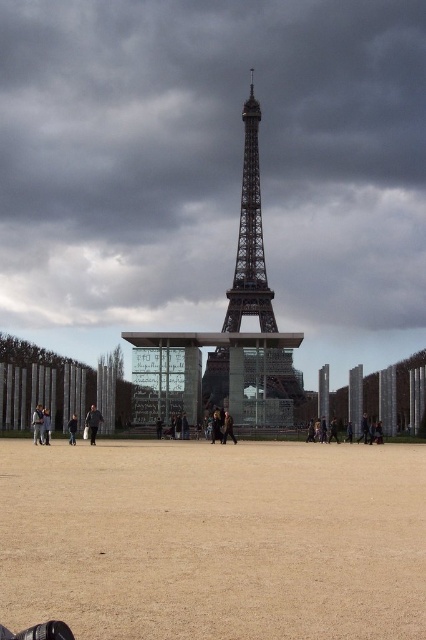
You are standing in the plaza in front of the Eiffel Tower and notice both the dark gray cloudy sky at upper center and the dark brown leather jacket at center. Which object is closer to you?

The dark brown leather jacket at center is behind the dark gray cloudy sky at upper center, so the dark gray cloudy sky at upper center is closer to you.

In the scene shown: You are an architect planning to install a large sculpture in the plaza area. Given the dark gray cloudy sky at upper center and the brown sandy dirt field at center, which one has a greater width in the image?

The dark gray cloudy sky at upper center might be wider than the brown sandy dirt field at center according to the description.

You are a tourist standing in front of the Eiffel Tower and looking at the dark gray cloudy sky at upper center and the brown sandy dirt field at center. Which object is closer to you?

The brown sandy dirt field at center is behind dark gray cloudy sky at upper center, so the dark gray cloudy sky at upper center is closer to you.